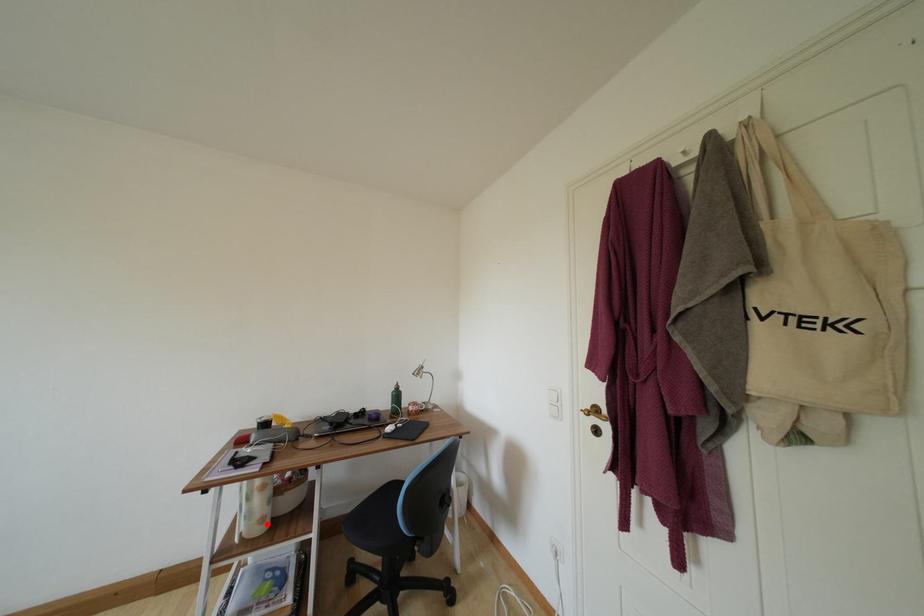
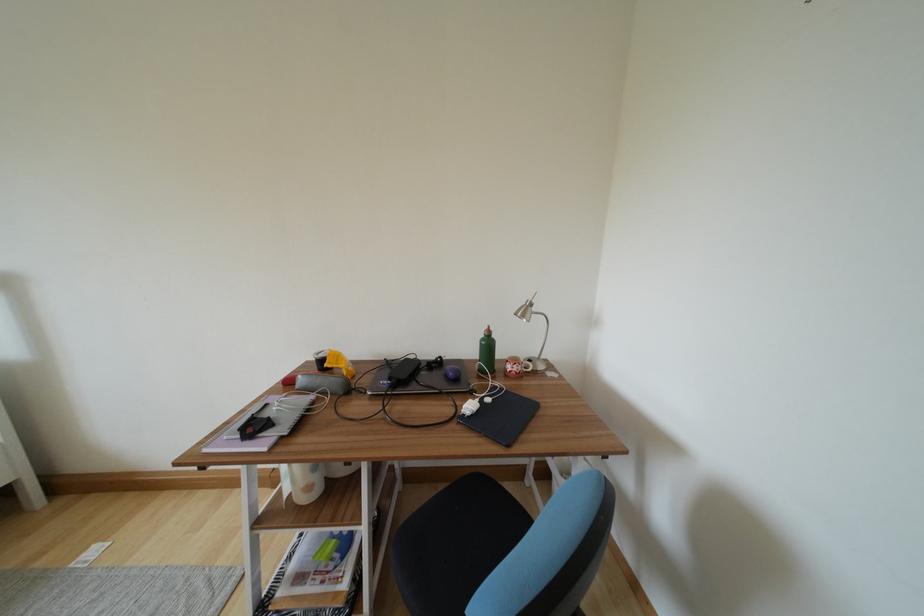
Question: A red point is marked in image1. In image2, is the corresponding 3D point closer to the camera or farther? Reply with the corresponding letter.

Choices:
 (A) The corresponding 3D point is closer.
 (B) The corresponding 3D point is farther.

Answer: (B)